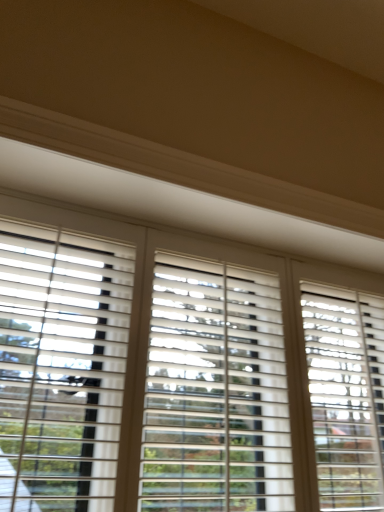
In order to face white wood blinds at center, should I rotate leftwards or rightwards?

You should rotate right by 5.254 degrees.

What is the approximate height of white wood blinds at center?

1.05 meters.

Describe the element at coordinates (180, 371) in the screenshot. I see `white wood blinds at center` at that location.

This screenshot has width=384, height=512. Find the location of `white wood blinds at center`. white wood blinds at center is located at coordinates (180, 371).

Identify the location of white wood blinds at center. The height and width of the screenshot is (512, 384). (180, 371).